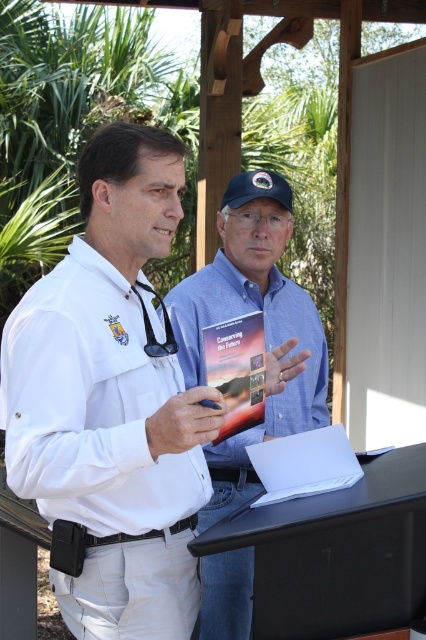
Is white matte shirt at center bigger than blue cotton shirt at center?

No, white matte shirt at center is not bigger than blue cotton shirt at center.

Image resolution: width=426 pixels, height=640 pixels. Find the location of `white matte shirt at center`. white matte shirt at center is located at coordinates pyautogui.click(x=111, y=403).

Measure the distance from white matte shirt at center to black rubber stethoscope at center.

The distance of white matte shirt at center from black rubber stethoscope at center is 11.21 inches.

Does white matte shirt at center have a greater height compared to black rubber stethoscope at center?

Indeed, white matte shirt at center has a greater height compared to black rubber stethoscope at center.

Is point (129, 570) positioned behind point (166, 332)?

No, (129, 570) is closer to viewer.

What are the coordinates of `white matte shirt at center` in the screenshot? It's located at (111, 403).

Is matte paper book at center thinner than black rubber stethoscope at center?

No.

Who is more forward, (256, 324) or (164, 321)?

Point (164, 321) is in front.

In order to click on matte paper book at center in this screenshot , I will do `click(236, 369)`.